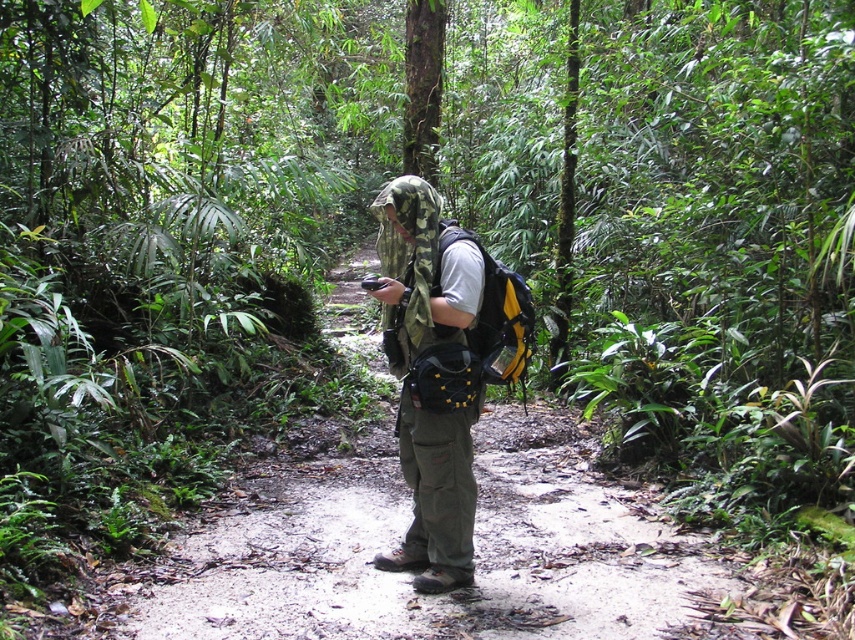
Where is `dull green backpack at center`? The width and height of the screenshot is (855, 640). dull green backpack at center is located at coordinates (408, 576).

Is dull green backpack at center taller than camouflage fabric hat at center?

Incorrect, dull green backpack at center's height is not larger of camouflage fabric hat at center's.

Where is `dull green backpack at center`? dull green backpack at center is located at coordinates (408, 576).

From the picture: Who is more forward, (x=387, y=616) or (x=420, y=456)?

Positioned in front is point (x=387, y=616).

Image resolution: width=855 pixels, height=640 pixels. In order to click on dull green backpack at center in this screenshot , I will do `click(408, 576)`.

Between camouflage fabric hat at center and yellow matte backpack at center, which one appears on the right side from the viewer's perspective?

Positioned to the right is yellow matte backpack at center.

From the picture: Is camouflage fabric hat at center taller than yellow matte backpack at center?

Indeed, camouflage fabric hat at center has a greater height compared to yellow matte backpack at center.

At what (x,y) coordinates should I click in order to perform the action: click on camouflage fabric hat at center. Please return your answer as a coordinate pair (x, y). Looking at the image, I should click on (435, 497).

At what (x,y) coordinates should I click in order to perform the action: click on camouflage fabric hat at center. Please return your answer as a coordinate pair (x, y). The width and height of the screenshot is (855, 640). Looking at the image, I should click on (435, 497).